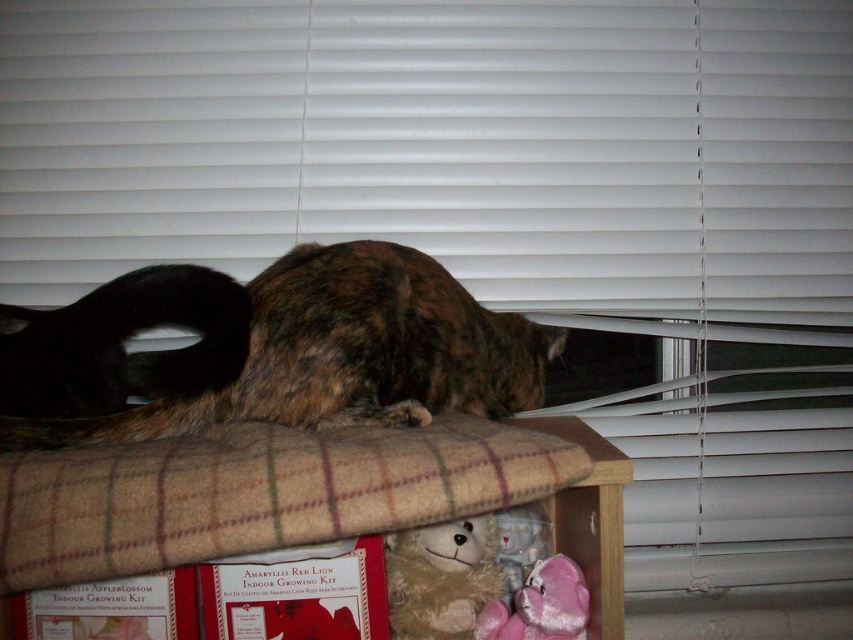
You are a cat owner who wants to place a new toy for your cats. You have a small wooden box in front of them and a velvet pink teddy bear at lower right. Which object is closer to you?

The velvet pink teddy bear at lower right is closer to you since it is only 33.68 inches away from the viewer, while the small wooden box is farther away.

You are a cat owner who wants to place a new toy for your cat. You have a small blue ball. Where should you put it so that it is closer to the brown fur cat at center than to the fluffy beige teddy bear at lower center?

Place the small blue ball between the brown fur cat at center and the fluffy beige teddy bear at lower center, closer to the brown fur cat at center. Since the brown fur cat at center is in front of the fluffy beige teddy bear at lower center, positioning the ball near the cat ensures it is closer to the cat than the teddy bear.

You are a cat owner who wants to place a new toy between the brown fur cat at center and the fluffy beige teddy bear at lower center. Can you fit the toy there if the toy is 15 cm wide?

The brown fur cat at center might be wider than the fluffy beige teddy bear at lower center, so there may not be enough space to fit a 15 cm wide toy between them.